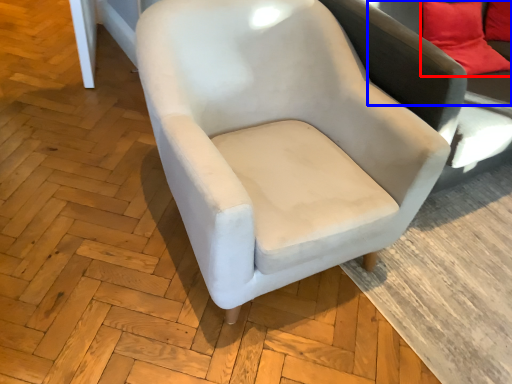
Question: Which object appears farthest to the camera in this image, pillow (highlighted by a red box) or couch (highlighted by a blue box)?

Choices:
 (A) pillow
 (B) couch

Answer: (A)